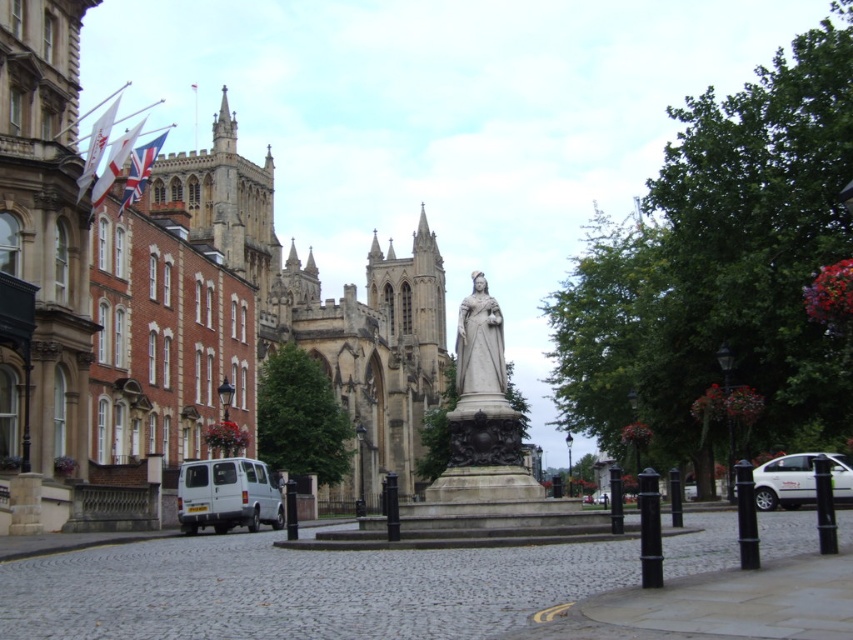
What do you see at coordinates (323, 301) in the screenshot? The height and width of the screenshot is (640, 853). I see `stone gothic church at center` at bounding box center [323, 301].

Where is `stone gothic church at center`? Image resolution: width=853 pixels, height=640 pixels. stone gothic church at center is located at coordinates (323, 301).

Does stone gothic church at center have a greater width compared to polished bronze statue at center?

Correct, the width of stone gothic church at center exceeds that of polished bronze statue at center.

Does stone gothic church at center lie behind polished bronze statue at center?

Yes, it is behind polished bronze statue at center.

Describe the element at coordinates (323, 301) in the screenshot. I see `stone gothic church at center` at that location.

The width and height of the screenshot is (853, 640). Find the location of `stone gothic church at center`. stone gothic church at center is located at coordinates (323, 301).

Can you confirm if white matte van at lower left is bigger than white matte car at lower right?

No, white matte van at lower left is not bigger than white matte car at lower right.

Which is in front, point (259, 499) or point (840, 474)?

Point (840, 474)

This screenshot has height=640, width=853. I want to click on white matte van at lower left, so click(x=227, y=496).